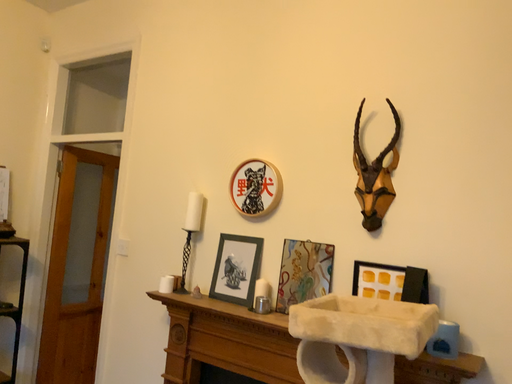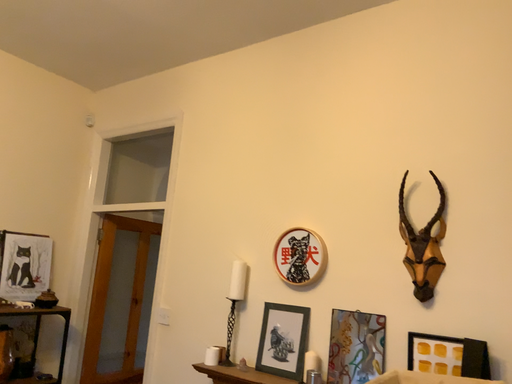
Question: How did the camera likely rotate when shooting the video?

Choices:
 (A) rotated upward
 (B) rotated downward

Answer: (A)